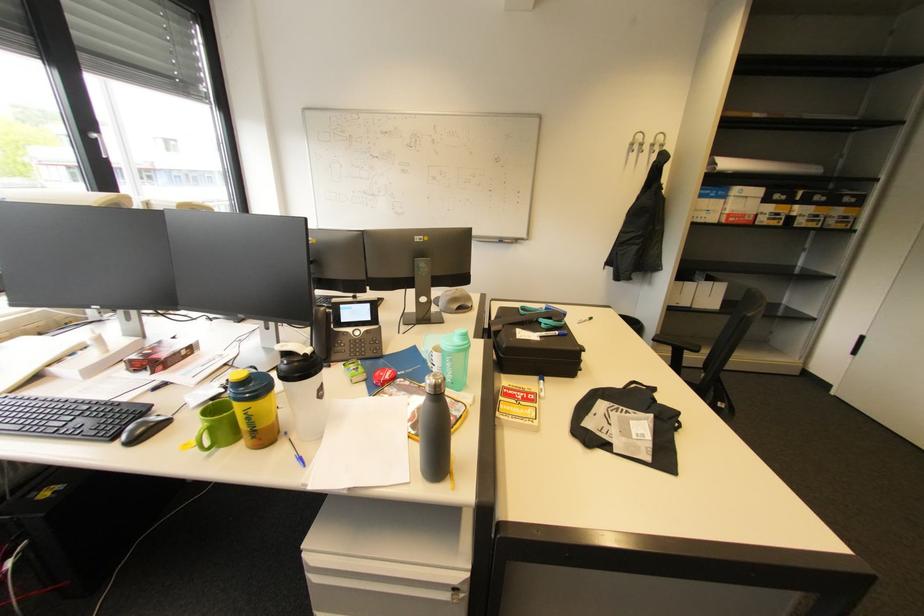
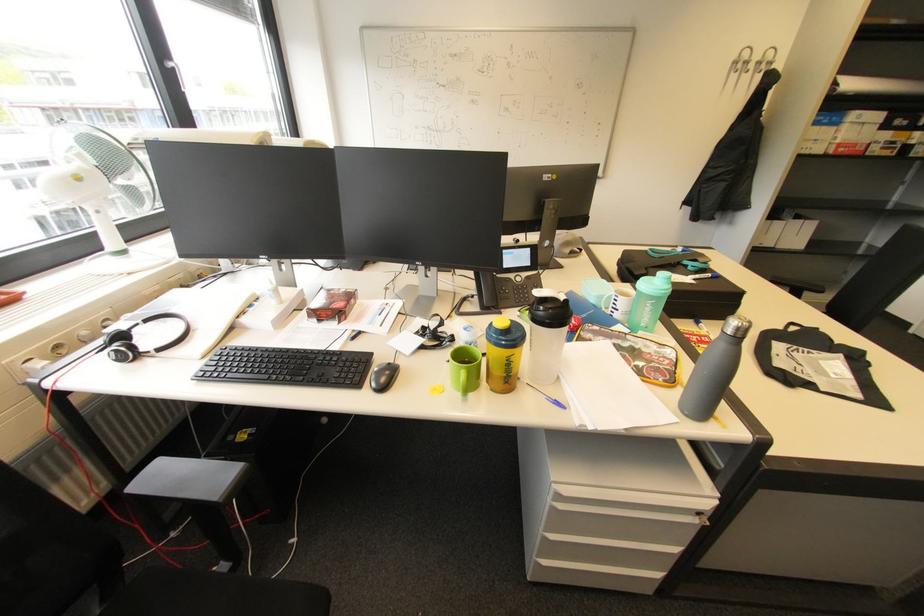
Locate, in the second image, the point that corresponds to (x=665, y=139) in the first image.

(775, 55)